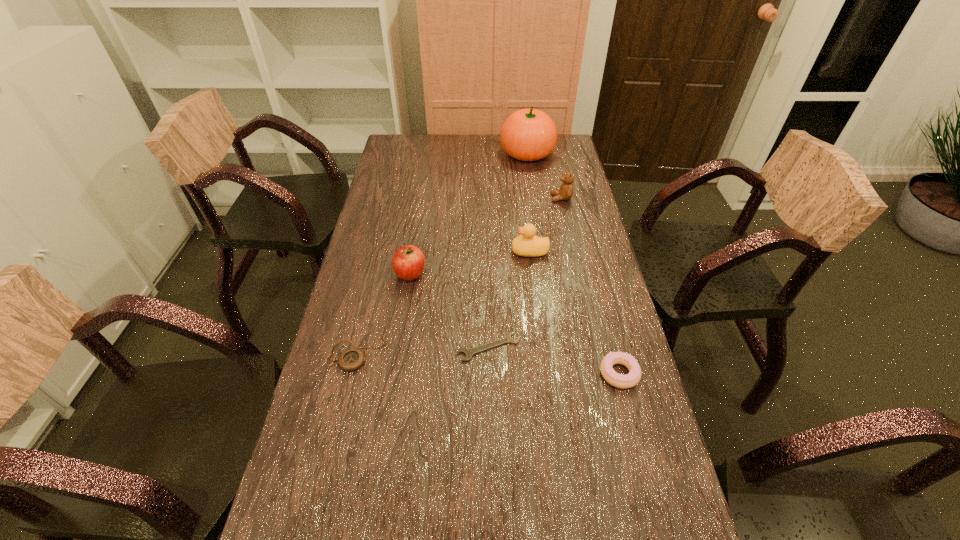
This screenshot has height=540, width=960. What are the coordinates of `object that ranks as the closest to the farthest object` in the screenshot? It's located at (566, 189).

Locate which object ranks in proximity to the sixth nearest object. Please provide its 2D coordinates. Your answer should be formatted as a tuple, i.e. [(x, y)], where the tuple contains the x and y coordinates of a point satisfying the conditions above.

[(529, 134)]

Find the location of a particular element. This screenshot has height=540, width=960. vacant space that satisfies the following two spatial constraints: 1. on the face of the fifth tallest object; 2. on the left side of the third farthest object is located at coordinates (544, 373).

Identify the location of free location that satisfies the following two spatial constraints: 1. on the face of the duck; 2. on the right side of the third shortest object. (544, 373).

This screenshot has width=960, height=540. Identify the location of free spot that satisfies the following two spatial constraints: 1. on the face of the second farthest object; 2. on the left side of the fifth tallest object. (600, 373).

At what (x,y) coordinates should I click in order to perform the action: click on free space that satisfies the following two spatial constraints: 1. on the face of the third shortest object; 2. on the left side of the third farthest object. Please return your answer as a coordinate pair (x, y). The image size is (960, 540). Looking at the image, I should click on (544, 373).

Where is `vacant space that satisfies the following two spatial constraints: 1. on the front side of the fifth tallest object; 2. on the right side of the pocket watch`? This screenshot has width=960, height=540. vacant space that satisfies the following two spatial constraints: 1. on the front side of the fifth tallest object; 2. on the right side of the pocket watch is located at coordinates click(x=351, y=373).

This screenshot has height=540, width=960. In order to click on free space that satisfies the following two spatial constraints: 1. on the front side of the shortest object; 2. on the right side of the doughnut in this screenshot , I will do `click(489, 373)`.